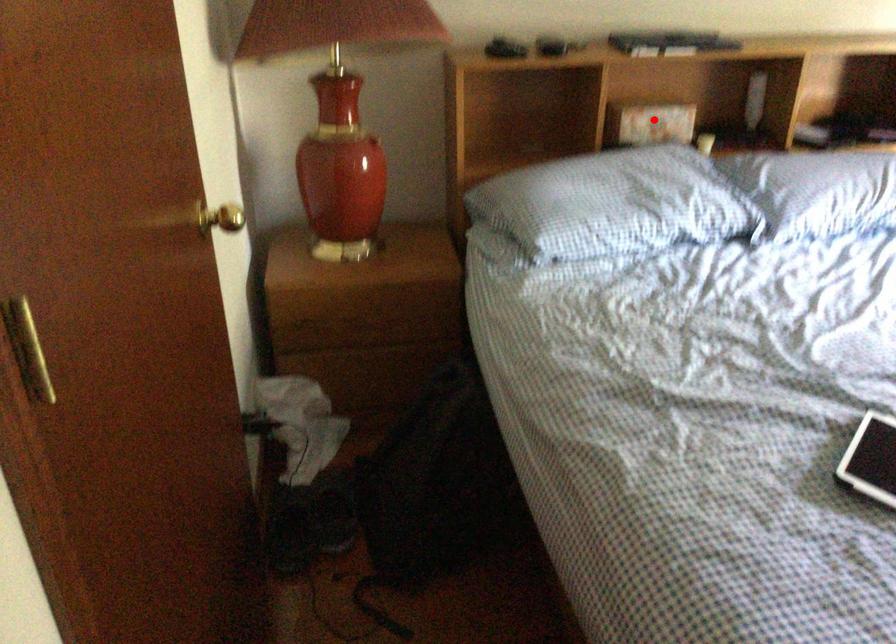
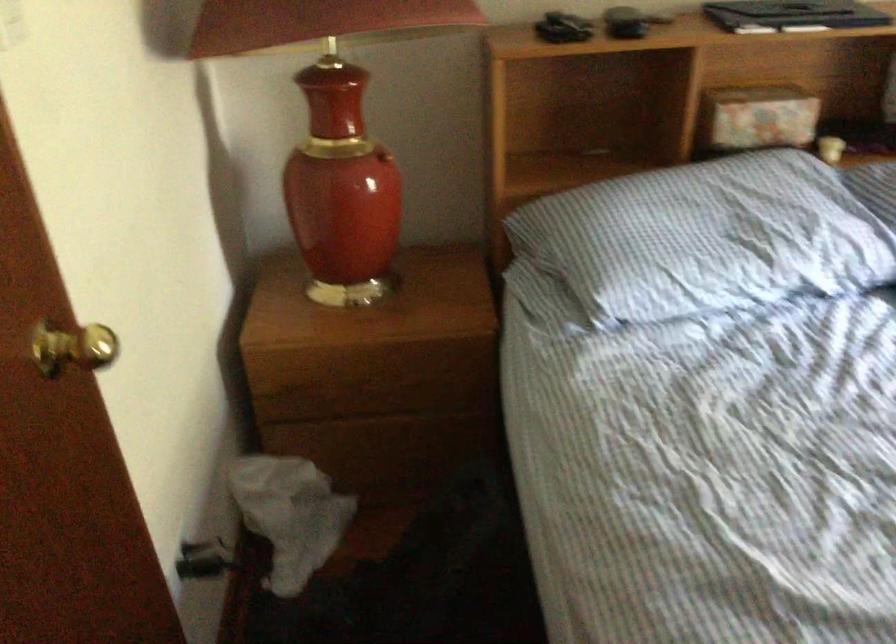
Question: I am providing you with two images of the same scene from different viewpoints. In image1, a red point is highlighted. Considering the same 3D point in image2, which of the following is correct?

Choices:
 (A) It is closer
 (B) It is farther

Answer: (A)